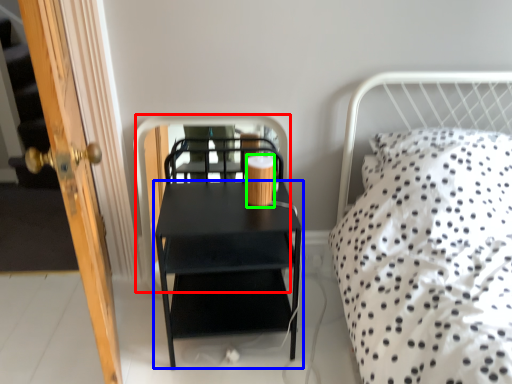
Question: Considering the real-world distances, which object is closest to screen door (highlighted by a red box)? nightstand (highlighted by a blue box) or coffee cup (highlighted by a green box).

Choices:
 (A) nightstand
 (B) coffee cup

Answer: (A)